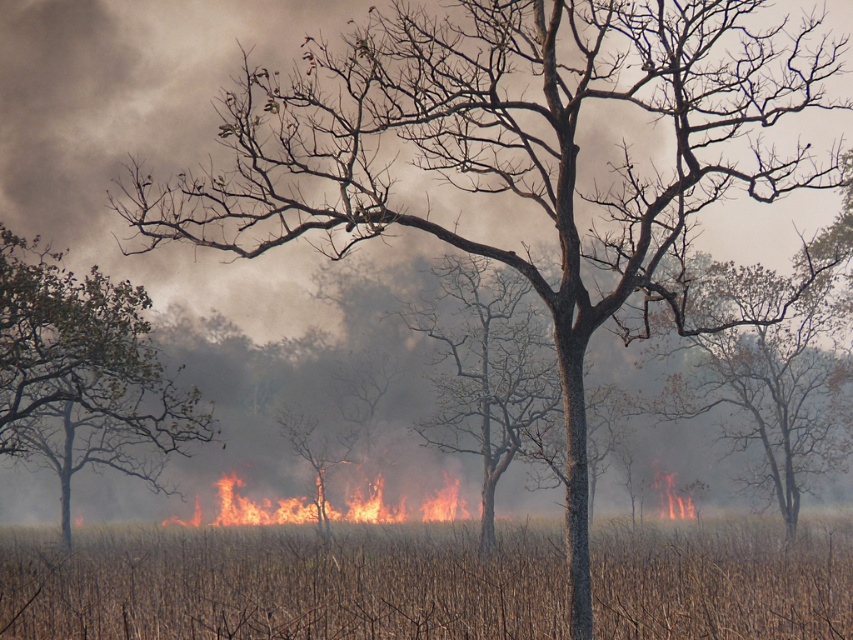
You are a firefighter assessing the wildfire scene. You notice the brown dry grass at center and the brown leafless tree at left. Which object is closer to you as you stand at the scene?

The brown dry grass at center is closer to you because it is in front of the brown leafless tree at left.

You are a firefighter assessing the wildfire scene. You see the smooth bark tree at center and the flaming grass at center. Which of these two objects is closer to you?

The smooth bark tree at center is closer to you than the flaming grass at center because it is positioned in front of it.